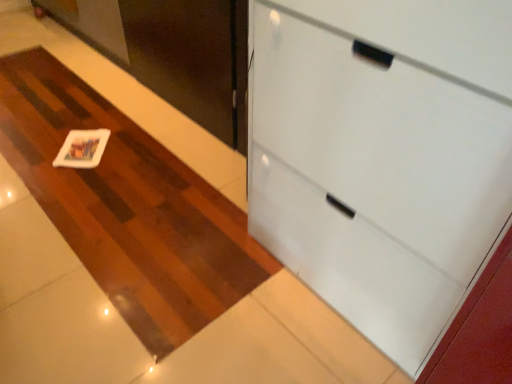
Question: Can you confirm if matte black door at upper left is taller than white matte card at center?

Choices:
 (A) no
 (B) yes

Answer: (B)

Question: Is matte black door at upper left not near white matte card at center?

Choices:
 (A) no
 (B) yes

Answer: (A)

Question: Does matte black door at upper left come behind white matte card at center?

Choices:
 (A) yes
 (B) no

Answer: (B)

Question: Is matte black door at upper left shorter than white matte card at center?

Choices:
 (A) no
 (B) yes

Answer: (A)

Question: Is matte black door at upper left wider than white matte card at center?

Choices:
 (A) yes
 (B) no

Answer: (B)

Question: Is matte black door at upper left in front of or behind white matte coaster at center in the image?

Choices:
 (A) behind
 (B) front

Answer: (A)

Question: Is point (160, 51) positioned closer to the camera than point (70, 175)?

Choices:
 (A) farther
 (B) closer

Answer: (A)

Question: Considering the positions of matte black door at upper left and white matte coaster at center in the image, is matte black door at upper left bigger or smaller than white matte coaster at center?

Choices:
 (A) big
 (B) small

Answer: (B)

Question: Is matte black door at upper left inside the boundaries of white matte coaster at center, or outside?

Choices:
 (A) outside
 (B) inside

Answer: (A)

Question: Considering the positions of white glossy cabinet at upper right and white matte coaster at center in the image, is white glossy cabinet at upper right bigger or smaller than white matte coaster at center?

Choices:
 (A) small
 (B) big

Answer: (B)

Question: Is point (348, 311) closer or farther from the camera than point (147, 216)?

Choices:
 (A) farther
 (B) closer

Answer: (B)

Question: From the image's perspective, is white glossy cabinet at upper right above or below white matte coaster at center?

Choices:
 (A) above
 (B) below

Answer: (B)

Question: In the image, is white glossy cabinet at upper right on the left side or the right side of white matte coaster at center?

Choices:
 (A) left
 (B) right

Answer: (B)

Question: From the image's perspective, is white matte card at center positioned above or below white matte coaster at center?

Choices:
 (A) above
 (B) below

Answer: (A)

Question: Relative to white matte coaster at center, is white matte card at center in front or behind?

Choices:
 (A) behind
 (B) front

Answer: (A)